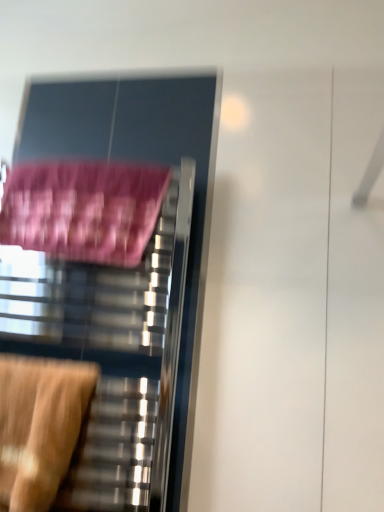
Question: In the image, is pink fabric bath towel at left positioned in front of or behind wooden swivel chair at lower left?

Choices:
 (A) behind
 (B) front

Answer: (A)

Question: Is point (51, 167) positioned closer to the camera than point (13, 365)?

Choices:
 (A) closer
 (B) farther

Answer: (B)

Question: Which is farther from the metallic towel rack at left?

Choices:
 (A) wooden swivel chair at lower left
 (B) pink fabric bath towel at left

Answer: (B)

Question: Estimate the real-world distances between objects in this image. Which object is farther from the metallic towel rack at left?

Choices:
 (A) wooden swivel chair at lower left
 (B) pink fabric bath towel at left

Answer: (B)